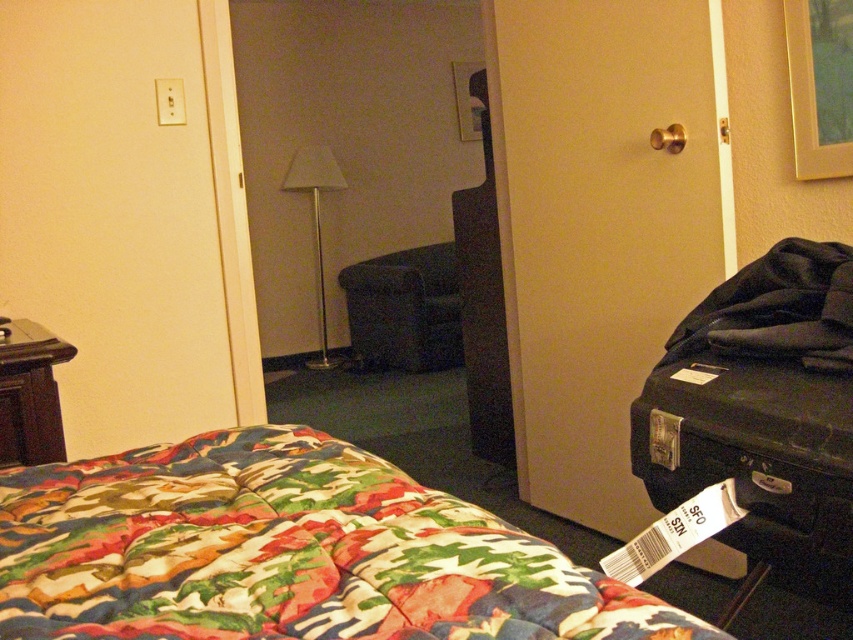
Question: Is camo-patterned blanket at lower left bigger than wooden picture frame at upper center?

Choices:
 (A) no
 (B) yes

Answer: (B)

Question: Observing the image, what is the correct spatial positioning of black hard suitcase at right in reference to gold wooden picture frame at upper right?

Choices:
 (A) left
 (B) right

Answer: (A)

Question: Can you confirm if white fabric lampshade at center is positioned below wooden picture frame at upper center?

Choices:
 (A) yes
 (B) no

Answer: (A)

Question: Which object is positioned closest to the black hard suitcase at right?

Choices:
 (A) gold wooden picture frame at upper right
 (B) brown wood dresser at left
 (C) white fabric lampshade at center
 (D) camo-patterned blanket at lower left

Answer: (D)

Question: Which point is closer to the camera taking this photo?

Choices:
 (A) (39, 422)
 (B) (502, 564)
 (C) (312, 224)
 (D) (477, 129)

Answer: (B)

Question: Which point is closer to the camera?

Choices:
 (A) (62, 444)
 (B) (508, 621)
 (C) (730, 392)
 (D) (798, 13)

Answer: (B)